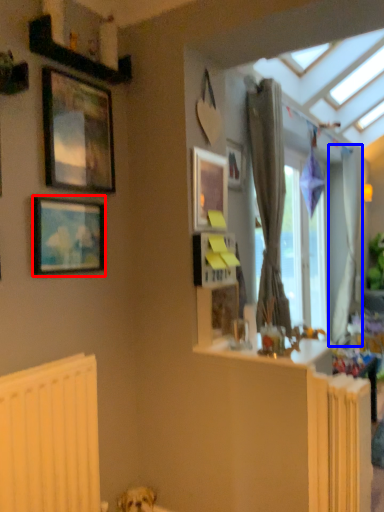
Question: Which point is closer to the camera, picture frame (highlighted by a red box) or curtain (highlighted by a blue box)?

Choices:
 (A) picture frame
 (B) curtain

Answer: (A)